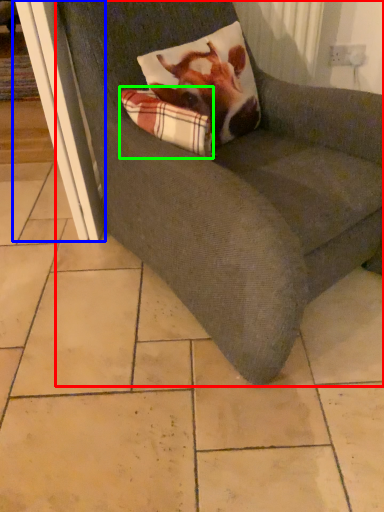
Question: Based on their relative distances, which object is farther from chair (highlighted by a red box)? Choose from screen door (highlighted by a blue box) and plaid (highlighted by a green box).

Choices:
 (A) screen door
 (B) plaid

Answer: (A)